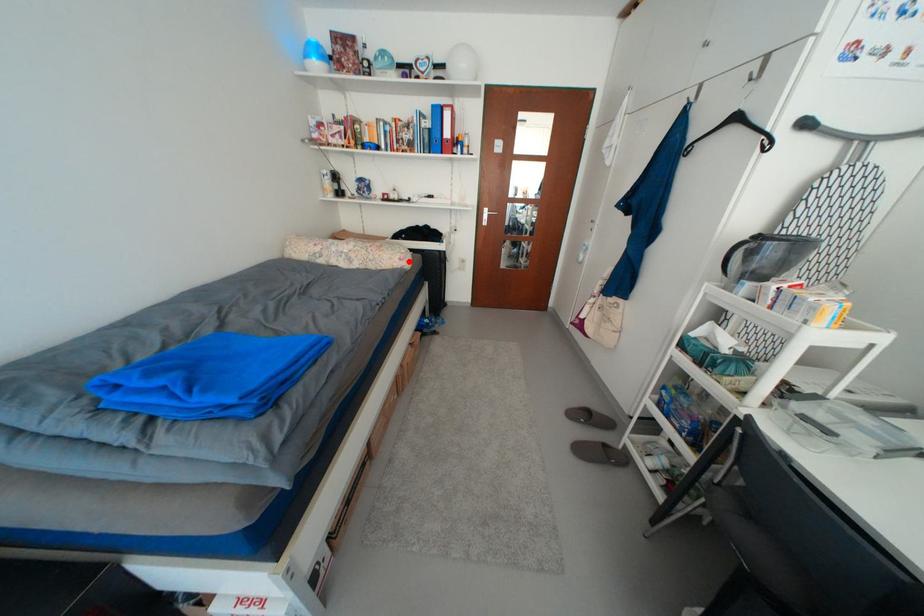
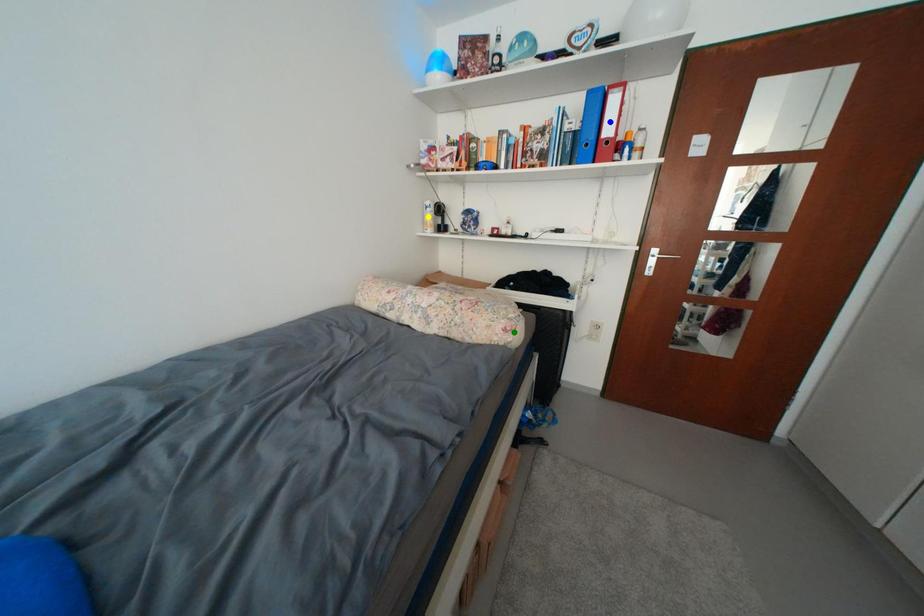
Question: I am providing you with two images of the same scene from different viewpoints. A red point is marked on the first image. You are given multiple points on the second image. Which spot in image 2 lines up with the point in image 1?

Choices:
 (A) yellow point
 (B) blue point
 (C) green point

Answer: (C)